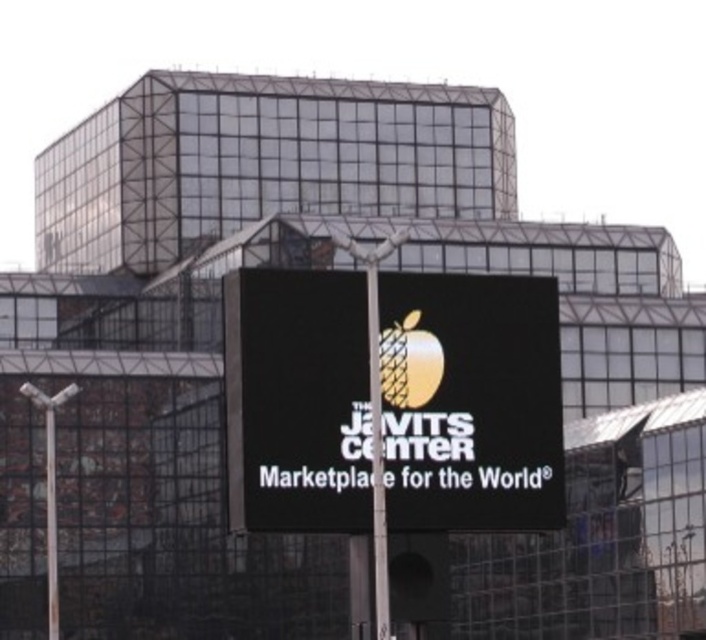
Question: Does black digital sign at center appear on the left side of metallic pole at center?

Choices:
 (A) no
 (B) yes

Answer: (A)

Question: Is black digital sign at center to the left of metallic pole at center from the viewer's perspective?

Choices:
 (A) yes
 (B) no

Answer: (B)

Question: Is black digital sign at center above metallic pole at center?

Choices:
 (A) no
 (B) yes

Answer: (B)

Question: Which object appears closest to the camera in this image?

Choices:
 (A) black digital sign at center
 (B) metallic pole at center

Answer: (B)

Question: Which point is farther to the camera?

Choices:
 (A) (378, 563)
 (B) (405, 401)

Answer: (B)

Question: Which point appears closest to the camera in this image?

Choices:
 (A) (376, 474)
 (B) (388, 372)

Answer: (A)